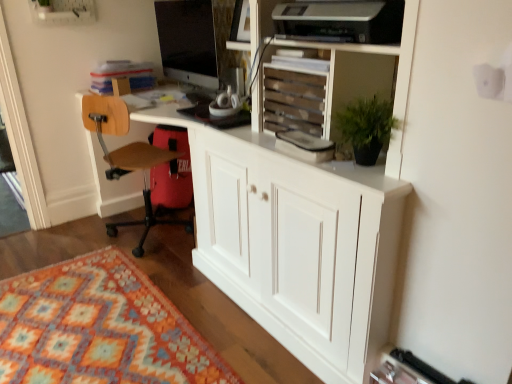
Question: From the image's perspective, is wooden slats at upper center below multicolored woven rug at lower left?

Choices:
 (A) no
 (B) yes

Answer: (A)

Question: Is wooden slats at upper center smaller than multicolored woven rug at lower left?

Choices:
 (A) no
 (B) yes

Answer: (B)

Question: Can we say wooden slats at upper center lies outside multicolored woven rug at lower left?

Choices:
 (A) no
 (B) yes

Answer: (B)

Question: Considering the relative sizes of wooden slats at upper center and multicolored woven rug at lower left in the image provided, is wooden slats at upper center bigger than multicolored woven rug at lower left?

Choices:
 (A) no
 (B) yes

Answer: (A)

Question: Does wooden slats at upper center appear on the right side of multicolored woven rug at lower left?

Choices:
 (A) yes
 (B) no

Answer: (A)

Question: Considering their positions, is wooden slats at upper center located in front of or behind matte black monitor at upper center?

Choices:
 (A) front
 (B) behind

Answer: (A)

Question: Do you think wooden slats at upper center is within matte black monitor at upper center, or outside of it?

Choices:
 (A) inside
 (B) outside

Answer: (B)

Question: From the image's perspective, is wooden slats at upper center located above or below matte black monitor at upper center?

Choices:
 (A) above
 (B) below

Answer: (B)

Question: Considering the relative positions of wooden slats at upper center and matte black monitor at upper center in the image provided, is wooden slats at upper center to the left or to the right of matte black monitor at upper center?

Choices:
 (A) left
 (B) right

Answer: (B)

Question: From a real-world perspective, is matte black monitor at upper center positioned above or below wooden slats at upper center?

Choices:
 (A) above
 (B) below

Answer: (A)

Question: Visually, is matte black monitor at upper center positioned to the left or to the right of wooden slats at upper center?

Choices:
 (A) right
 (B) left

Answer: (B)

Question: Which is correct: matte black monitor at upper center is inside wooden slats at upper center, or outside of it?

Choices:
 (A) outside
 (B) inside

Answer: (A)

Question: Based on their sizes in the image, would you say matte black monitor at upper center is bigger or smaller than wooden slats at upper center?

Choices:
 (A) small
 (B) big

Answer: (B)

Question: Considering the positions of point [x=170, y=69] and point [x=134, y=372], is point [x=170, y=69] closer or farther from the camera than point [x=134, y=372]?

Choices:
 (A) closer
 (B) farther

Answer: (B)

Question: Relative to multicolored woven rug at lower left, is matte black monitor at upper center in front or behind?

Choices:
 (A) behind
 (B) front

Answer: (A)